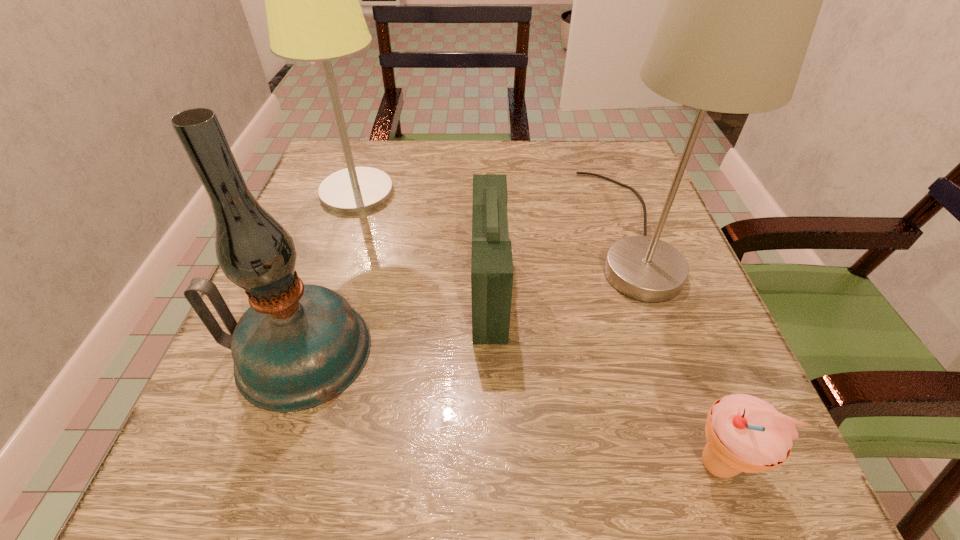
The width and height of the screenshot is (960, 540). I want to click on object that is positioned at the near right corner, so click(x=744, y=433).

Where is `vacant space at the far edge of the desktop`? This screenshot has width=960, height=540. vacant space at the far edge of the desktop is located at coordinates (423, 179).

Find the location of a particular element. vacant space at the near edge of the desktop is located at coordinates (372, 474).

The height and width of the screenshot is (540, 960). Identify the location of blank space at the left edge of the desktop. (311, 198).

You are a GUI agent. You are given a task and a screenshot of the screen. Output one action in this format:
    pyautogui.click(x=<x>, y=<y>)
    Task: Click on the vacant region at the right edge
    
    Given the screenshot: What is the action you would take?
    pyautogui.click(x=671, y=362)

Locate an element on the screen. vacant point at the far left corner is located at coordinates (317, 169).

The width and height of the screenshot is (960, 540). Find the location of `vacant space at the near left corner of the desktop`. vacant space at the near left corner of the desktop is located at coordinates (313, 433).

Find the location of a particular element. The image size is (960, 540). vacant space at the far right corner is located at coordinates (618, 152).

Where is `vacant space at the near right corner`? vacant space at the near right corner is located at coordinates (722, 483).

Where is `free space that is in between the left table lamp and the first-aid kit`? free space that is in between the left table lamp and the first-aid kit is located at coordinates (423, 241).